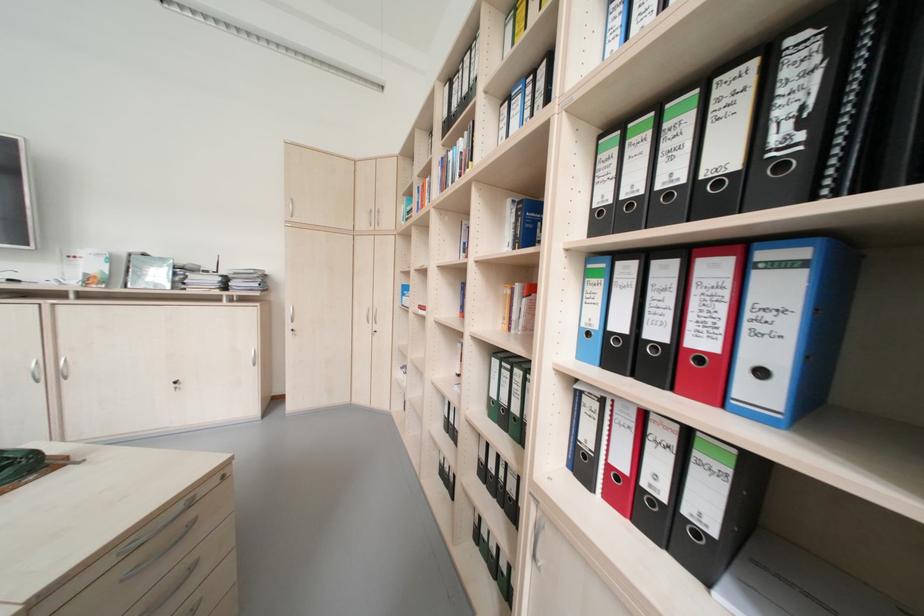
Describe the element at coordinates (760, 373) in the screenshot. Image resolution: width=924 pixels, height=616 pixels. I see `the cabinet keyhole` at that location.